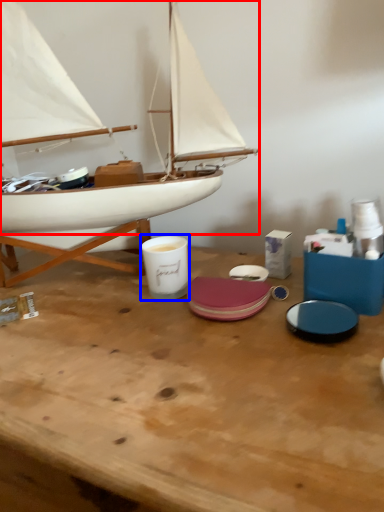
Question: Which point is closer to the camera, boat (highlighted by a red box) or tableware (highlighted by a blue box)?

Choices:
 (A) boat
 (B) tableware

Answer: (A)